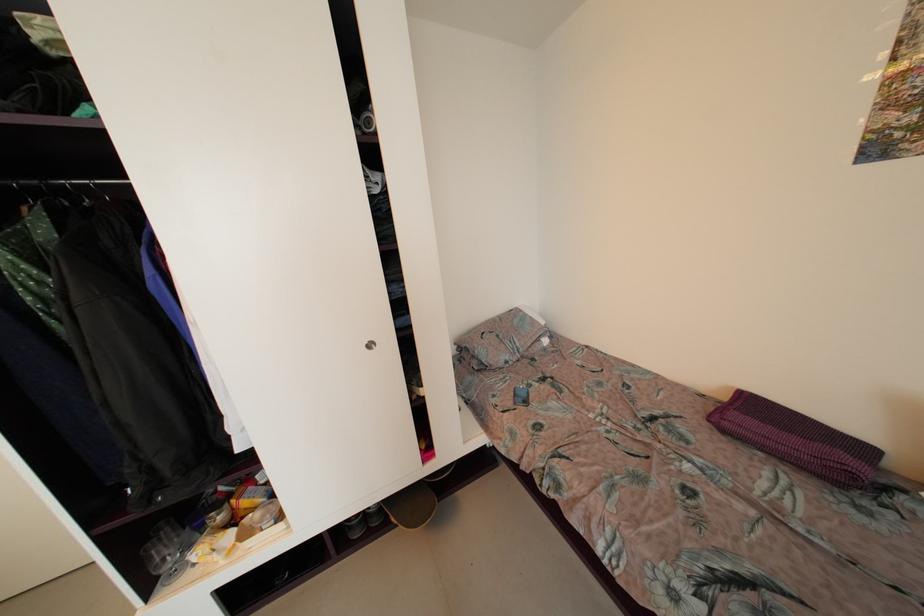
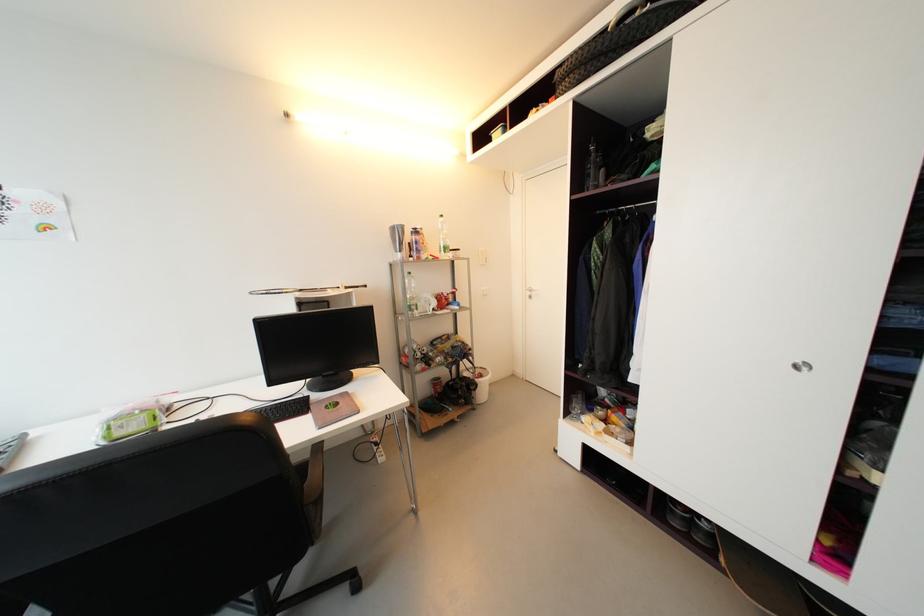
Question: The images are taken continuously from a first-person perspective. In which direction is your viewpoint rotating?

Choices:
 (A) Left
 (B) Right
 (C) Up
 (D) Down

Answer: (A)